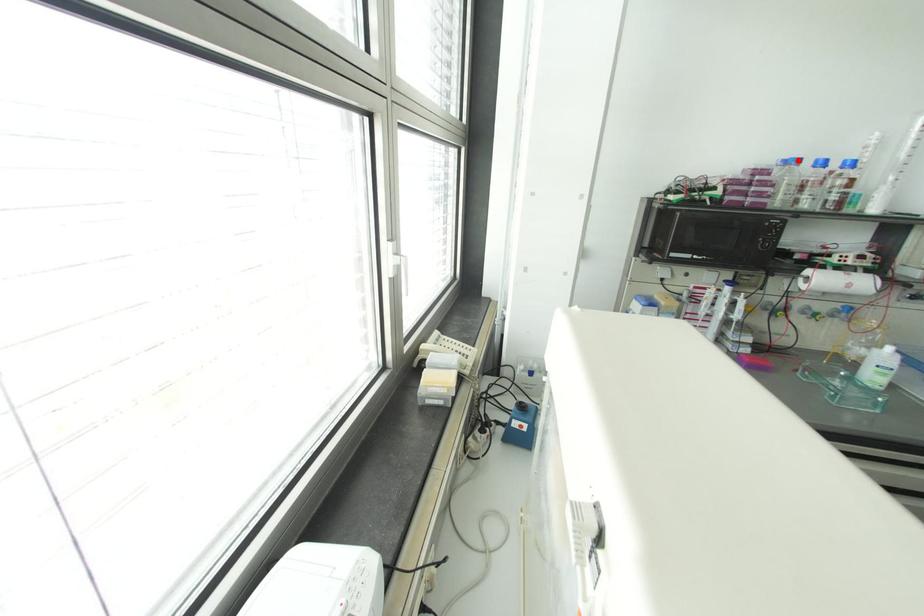
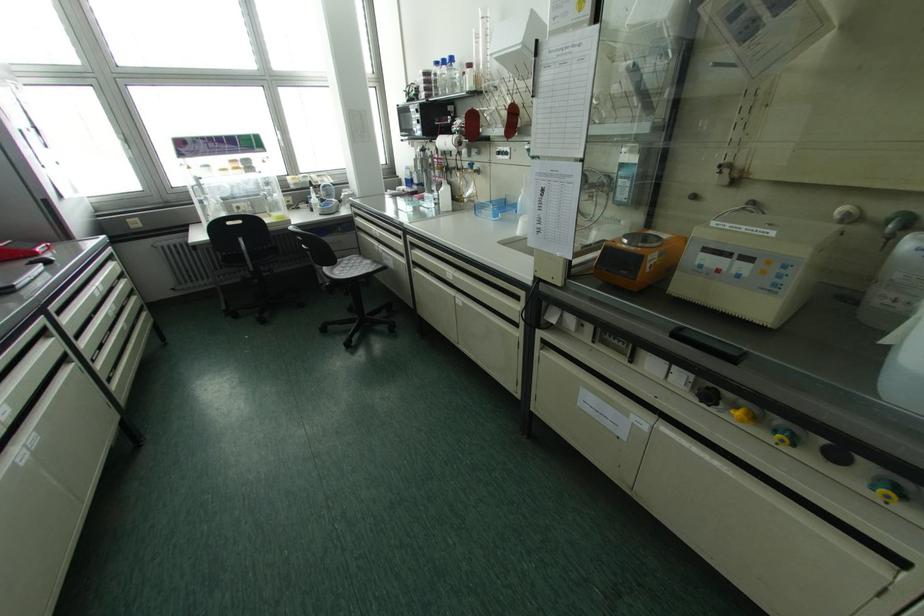
The point at the highlighted location is marked in the first image. Where is the corresponding point in the second image?

(435, 63)